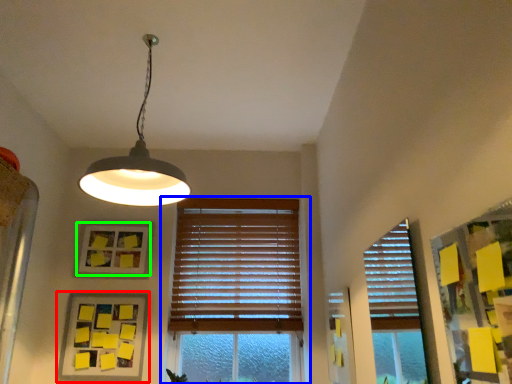
Question: Considering the real-world distances, which object is farthest from picture frame (highlighted by a red box)? window (highlighted by a blue box) or picture frame (highlighted by a green box)?

Choices:
 (A) window
 (B) picture frame

Answer: (A)